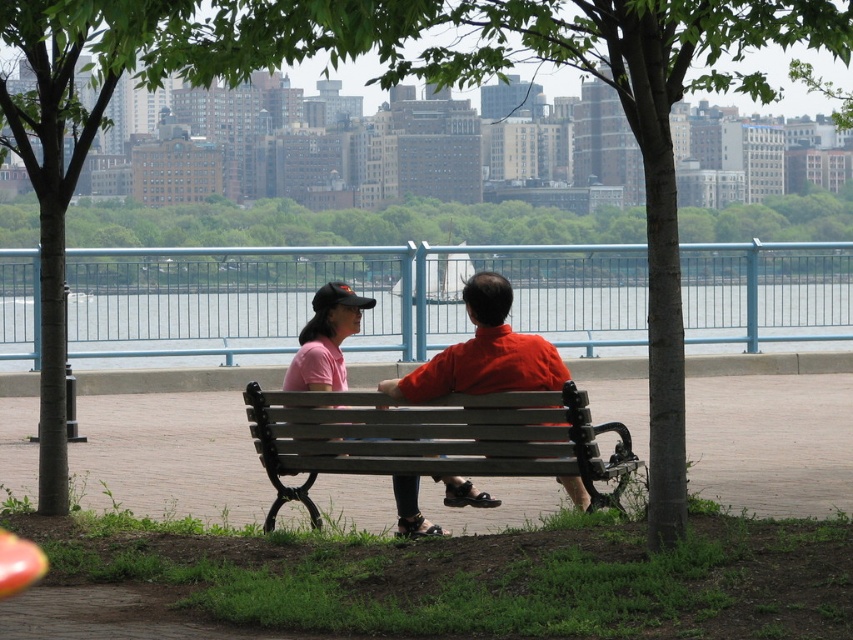
You are a photographer trying to capture a candid shot of the matte orange shirt at center without including the wooden bench at center in the frame. Based on their positions, is this possible?

The wooden bench at center is positioned under matte orange shirt at center, so the bench is directly beneath the shirt. To avoid the bench in the photo, you would need to angle the camera upwards to focus solely on the matte orange shirt at center while excluding the bench below.

Looking at this image, you are a painter standing in the park and want to paint the scene. You need to decide whether the wooden bench at center will be taller than the matte orange shirt at center in your painting. Based on the scene, what should you paint?

The wooden bench at center has a greater height compared to matte orange shirt at center, so in your painting, the wooden bench at center should be depicted as taller than the matte orange shirt at center.